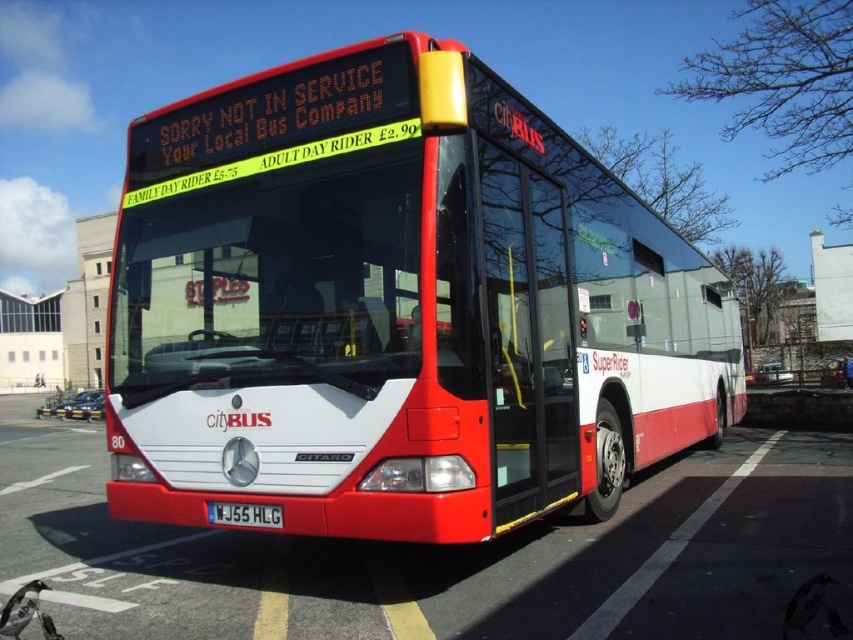
Is point (300, 356) farther from viewer compared to point (258, 595)?

No, (300, 356) is in front of (258, 595).

Where is `matte white bus at center`? The height and width of the screenshot is (640, 853). matte white bus at center is located at coordinates (396, 307).

Does white glossy bus at center have a smaller size compared to black plastic license plate at center?

Actually, white glossy bus at center might be larger than black plastic license plate at center.

Can you confirm if white glossy bus at center is wider than black plastic license plate at center?

Indeed, white glossy bus at center has a greater width compared to black plastic license plate at center.

In order to click on white glossy bus at center in this screenshot , I will do `click(439, 556)`.

Measure the distance between matte white bus at center and camera.

4.29 meters

Who is higher up, matte white bus at center or black plastic license plate at center?

black plastic license plate at center

Does point (294, 156) lie behind point (212, 524)?

Yes, it is behind point (212, 524).

The width and height of the screenshot is (853, 640). What are the coordinates of `matte white bus at center` in the screenshot? It's located at 396,307.